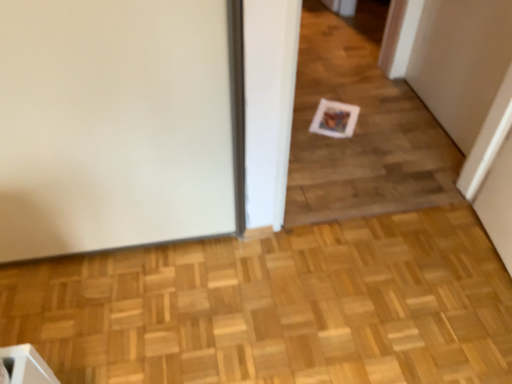
Find the location of `vacant point above natural wood flooring at lower center (from a real-world perspective)`. vacant point above natural wood flooring at lower center (from a real-world perspective) is located at coordinates (173, 334).